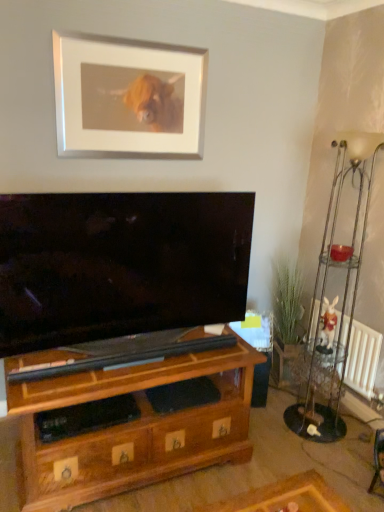
Where is `vacant area that lies in front of metallic silver floor lamp at right`? The height and width of the screenshot is (512, 384). vacant area that lies in front of metallic silver floor lamp at right is located at coordinates (328, 458).